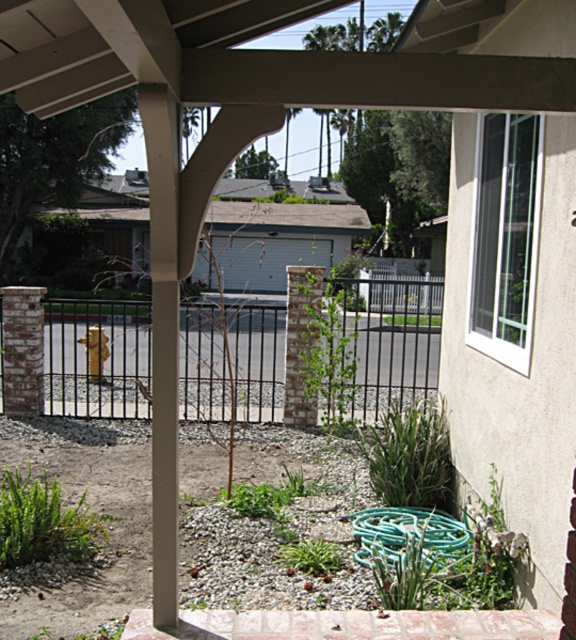
You are a painter who needs to assess the size of the objects in the scene. Which object, the black metal fence at center or the green rubber hose at lower center, is larger?

The black metal fence at center is bigger than the green rubber hose at lower center.